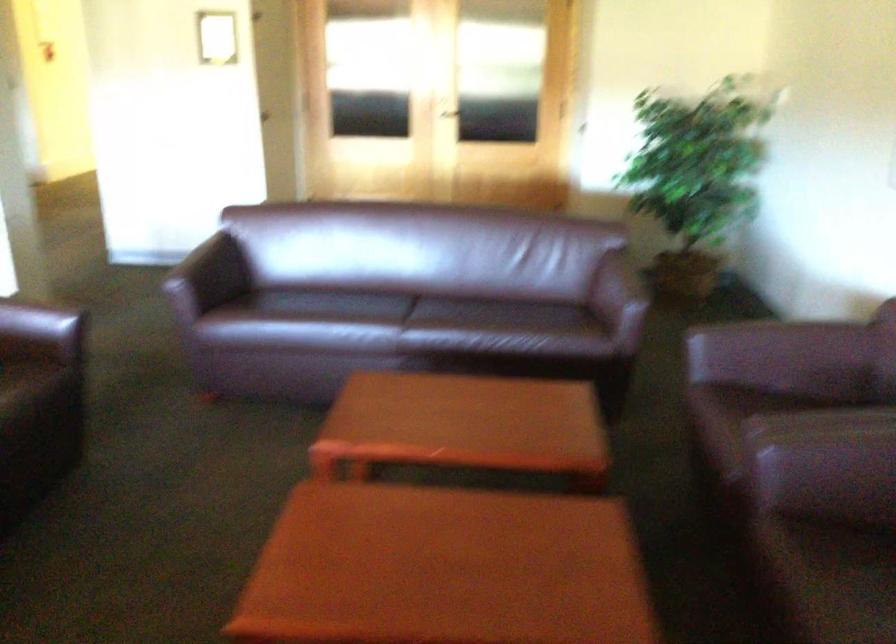
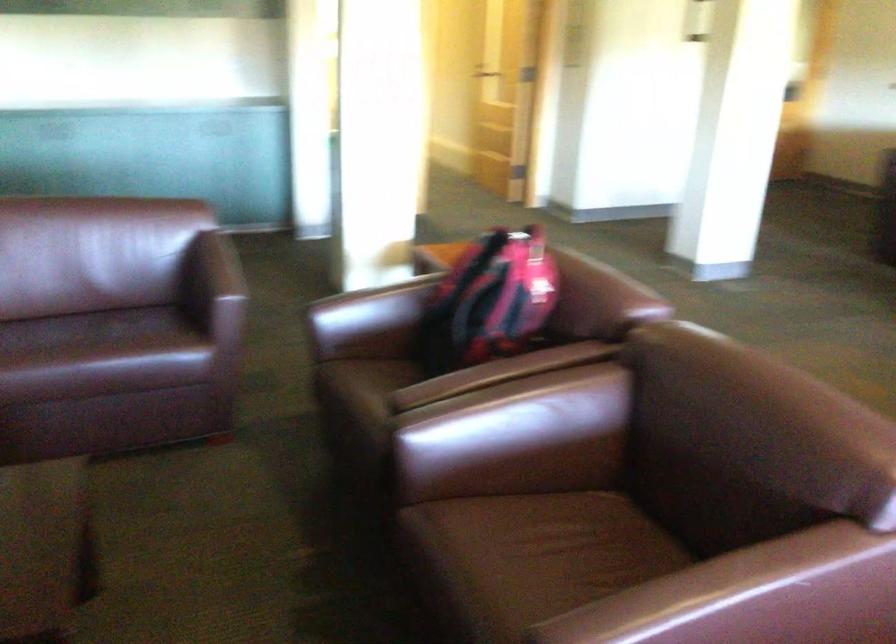
Based on the continuous images, in which direction is the camera rotating?

The rotation direction of the camera is right-down.